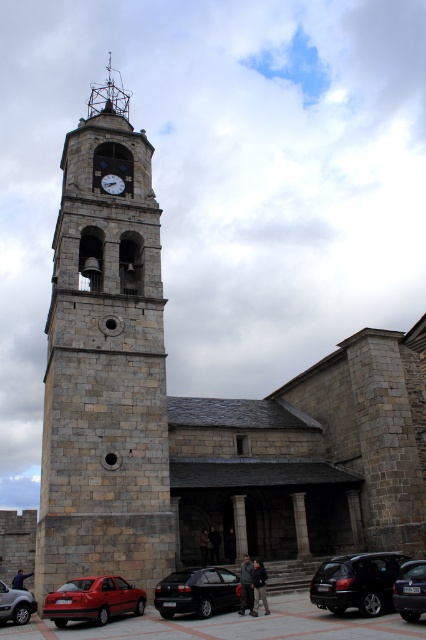
You are a delivery driver who needs to park your vehicle in the parking lot near the historic stone church. You have a shiny black suv at lower right and a dark gray metallic van at center. Which vehicle will require more space to park?

The shiny black suv at lower right is larger in size than the dark gray metallic van at center, so it will require more space to park.

You are a delivery person needing to park your vehicle in the church parking lot. The parking spot you want is narrow and can only accommodate vehicles narrower than the dark gray metallic van at center. Do you think your shiny black suv at lower right can fit into this spot?

The shiny black suv at lower right is wider than the dark gray metallic van at center, so it cannot fit into the parking spot designed for vehicles narrower than the van.